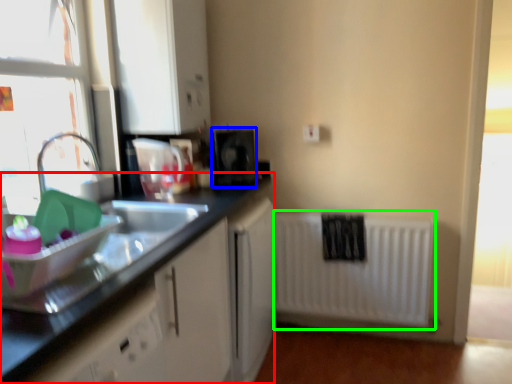
Question: Which is farther away from countertop (highlighted by a red box)? appliance (highlighted by a blue box) or radiator (highlighted by a green box)?

Choices:
 (A) appliance
 (B) radiator

Answer: (B)